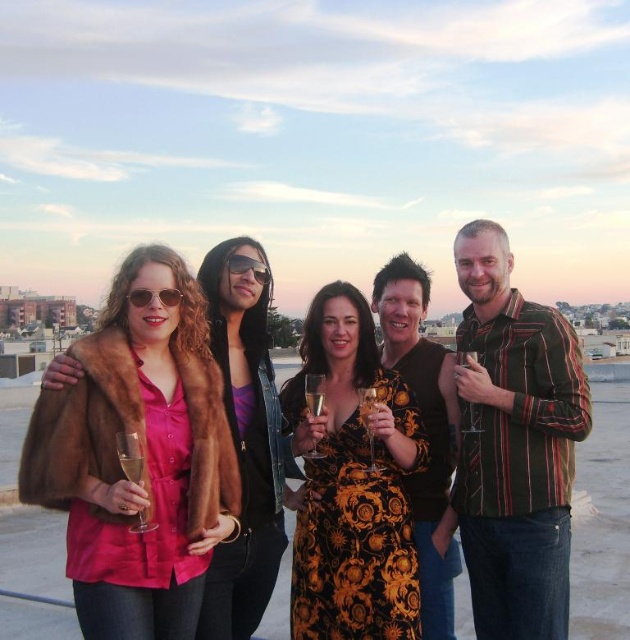
Consider the image. You are a photographer trying to capture a photo of the group. You notice the matte brown fur coat at center and the floral dress at center. To ensure both are fully visible in the frame, which one requires you to adjust your camera angle upwards more?

The floral dress at center requires adjusting the camera angle upwards more because it is taller than the matte brown fur coat at center.

You are a fashion blogger analyzing the outfits in the image. You notice two shirts in the group photo. The striped cotton shirt at right and the black textured shirt at center. Which shirt has a larger size?

The striped cotton shirt at right is larger in size than the black textured shirt at center.

You are standing at the origin point in the image. Where is the matte brown fur coat at center located in terms of coordinates?

The matte brown fur coat at center is located at coordinates point (x=146, y=456).